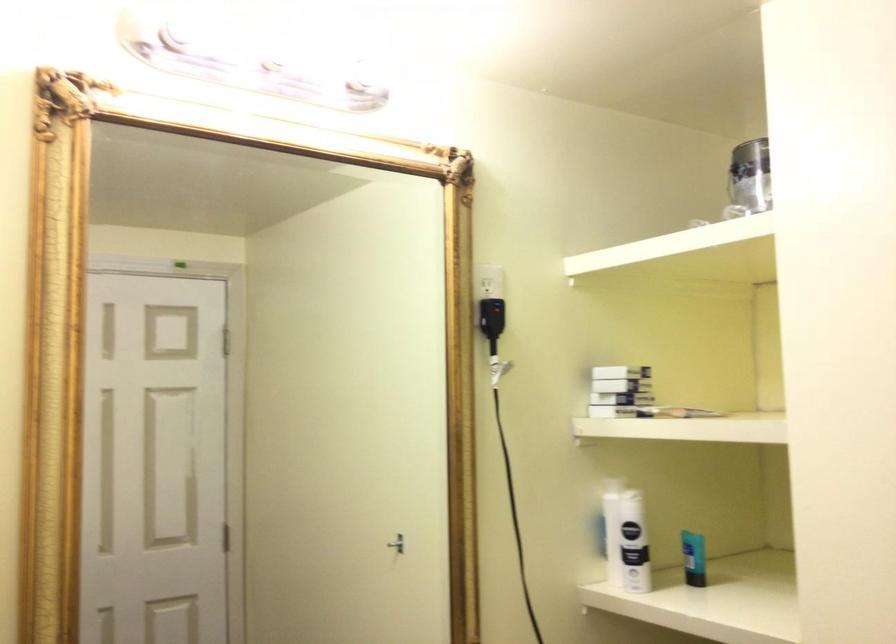
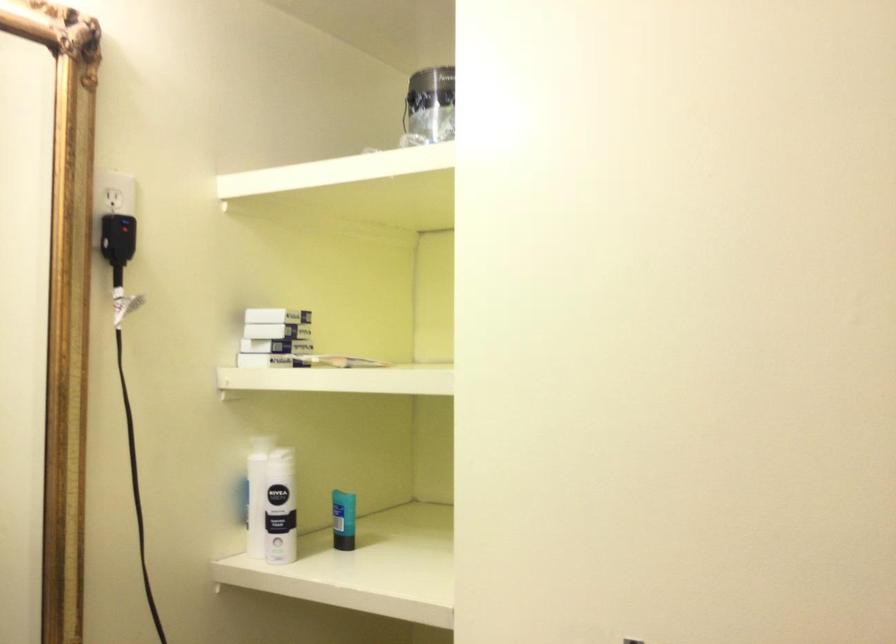
In the second image, find the point that corresponds to the point at 631,399 in the first image.

(273, 346)